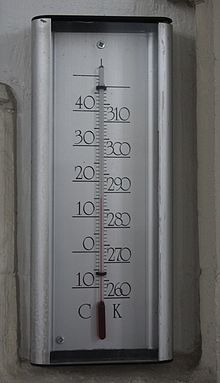
Identify the location of wall. (203, 311).